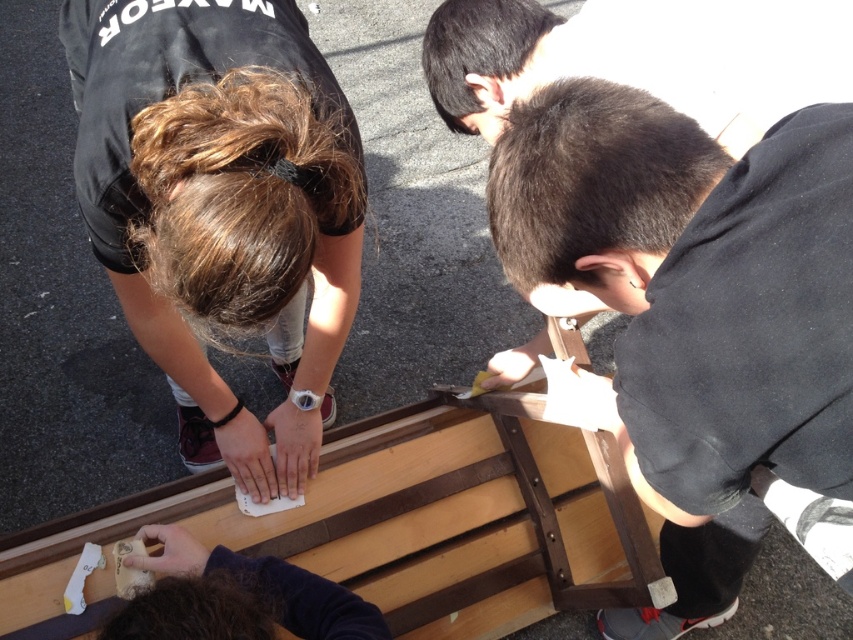
Does matte black shirt at upper left appear under wooden plank at center?

Actually, matte black shirt at upper left is above wooden plank at center.

The width and height of the screenshot is (853, 640). I want to click on matte black shirt at upper left, so click(x=221, y=209).

Is point (300, 380) more distant than point (686, 109)?

Yes.

This screenshot has width=853, height=640. What do you see at coordinates (221, 209) in the screenshot?
I see `matte black shirt at upper left` at bounding box center [221, 209].

Locate an element on the screen. The width and height of the screenshot is (853, 640). matte black shirt at upper left is located at coordinates (221, 209).

I want to click on matte black shirt at upper left, so click(221, 209).

Measure the distance from smooth brown wood at center to matte black shirt at upper left.

smooth brown wood at center is 58.47 centimeters from matte black shirt at upper left.

Does smooth brown wood at center appear over matte black shirt at upper left?

No, smooth brown wood at center is not above matte black shirt at upper left.

Identify the location of smooth brown wood at center. (692, 312).